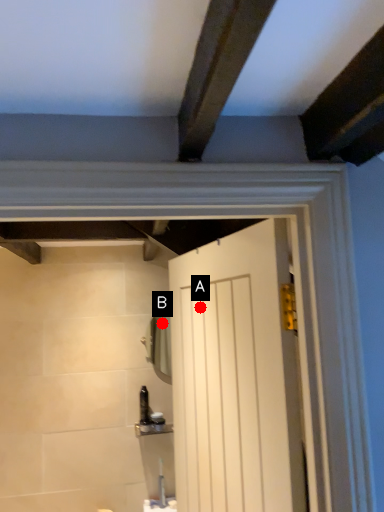
Question: Two points are circled on the image, labeled by A and B beside each circle. Which point is further to the camera?

Choices:
 (A) A is further
 (B) B is further

Answer: (B)